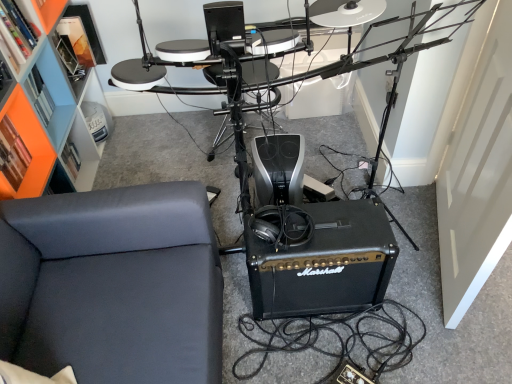
Question: From a real-world perspective, does orange matte bookshelf at upper left sit lower than orange matte bookshelf at upper left?

Choices:
 (A) yes
 (B) no

Answer: (A)

Question: Does orange matte bookshelf at upper left have a lesser width compared to orange matte bookshelf at upper left?

Choices:
 (A) no
 (B) yes

Answer: (A)

Question: Is orange matte bookshelf at upper left wider than orange matte bookshelf at upper left?

Choices:
 (A) no
 (B) yes

Answer: (B)

Question: Is orange matte bookshelf at upper left closer to camera compared to orange matte bookshelf at upper left?

Choices:
 (A) no
 (B) yes

Answer: (B)

Question: Is orange matte bookshelf at upper left a part of orange matte bookshelf at upper left?

Choices:
 (A) yes
 (B) no

Answer: (A)

Question: Can you confirm if orange matte bookshelf at upper left is bigger than orange matte bookshelf at upper left?

Choices:
 (A) yes
 (B) no

Answer: (A)

Question: Considering the relative sizes of black leather couch at lower left and black plastic drum set at center in the image provided, is black leather couch at lower left wider than black plastic drum set at center?

Choices:
 (A) no
 (B) yes

Answer: (B)

Question: Is black leather couch at lower left positioned far away from black plastic drum set at center?

Choices:
 (A) no
 (B) yes

Answer: (A)

Question: From the image's perspective, is black leather couch at lower left on top of black plastic drum set at center?

Choices:
 (A) no
 (B) yes

Answer: (A)

Question: Considering the relative sizes of black leather couch at lower left and black plastic drum set at center in the image provided, is black leather couch at lower left shorter than black plastic drum set at center?

Choices:
 (A) no
 (B) yes

Answer: (B)

Question: Considering the relative sizes of black leather couch at lower left and black plastic drum set at center in the image provided, is black leather couch at lower left bigger than black plastic drum set at center?

Choices:
 (A) yes
 (B) no

Answer: (B)

Question: Is black leather couch at lower left not inside black plastic drum set at center?

Choices:
 (A) yes
 (B) no

Answer: (A)

Question: Is black leather couch at lower left far from black matte marshall amplifier at center?

Choices:
 (A) yes
 (B) no

Answer: (B)